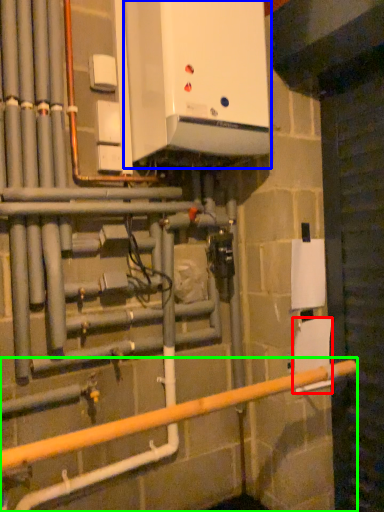
Question: Estimate the real-world distances between objects in this image. Which object is farther from toilet paper (highlighted by a red box), home appliance (highlighted by a blue box) or rail (highlighted by a green box)?

Choices:
 (A) home appliance
 (B) rail

Answer: (A)